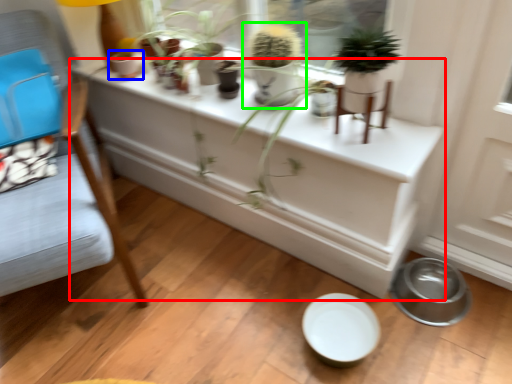
Question: Estimate the real-world distances between objects in this image. Which object is closer to table (highlighted by a red box), flowerpot (highlighted by a blue box) or houseplant (highlighted by a green box)?

Choices:
 (A) flowerpot
 (B) houseplant

Answer: (B)